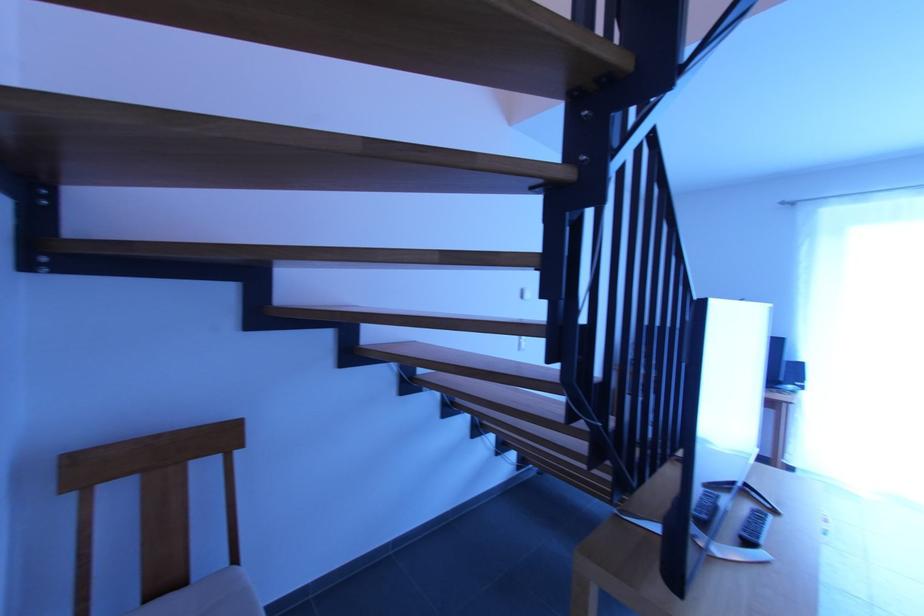
Find the location of a particular element. The height and width of the screenshot is (616, 924). chair sitting surface is located at coordinates (208, 598).